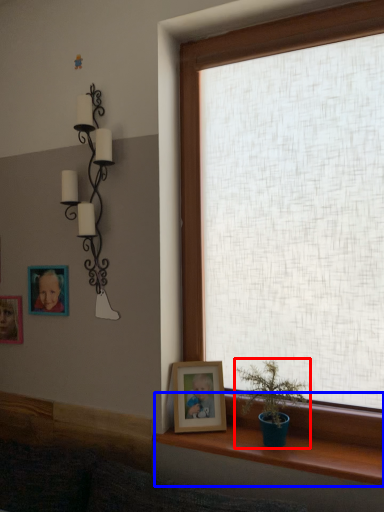
Question: Which object is further to the camera taking this photo, houseplant (highlighted by a red box) or window sill (highlighted by a blue box)?

Choices:
 (A) houseplant
 (B) window sill

Answer: (A)